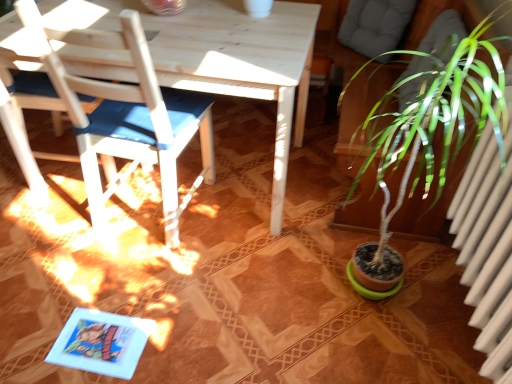
Question: Is point (82, 97) positioned closer to the camera than point (181, 91)?

Choices:
 (A) farther
 (B) closer

Answer: (B)

Question: From the image's perspective, is white wood chair at left, the first chair viewed from the left, located above or below white wood chair at left, arranged as the first chair when viewed from the right?

Choices:
 (A) below
 (B) above

Answer: (B)

Question: In terms of size, does white wood chair at left, arranged as the second chair when viewed from the right, appear bigger or smaller than white wood chair at left, which is counted as the second chair, starting from the left?

Choices:
 (A) small
 (B) big

Answer: (A)

Question: Is point (154, 134) positioned closer to the camera than point (20, 109)?

Choices:
 (A) farther
 (B) closer

Answer: (B)

Question: Is white wood chair at left, arranged as the first chair when viewed from the right, inside the boundaries of white wood chair at left, the first chair viewed from the left, or outside?

Choices:
 (A) inside
 (B) outside

Answer: (B)

Question: From the image's perspective, relative to white wood chair at left, the first chair viewed from the left, is white wood chair at left, arranged as the first chair when viewed from the right, above or below?

Choices:
 (A) below
 (B) above

Answer: (A)

Question: In terms of height, does white wood chair at left, which is counted as the second chair, starting from the left, look taller or shorter compared to white wood chair at left, arranged as the second chair when viewed from the right?

Choices:
 (A) tall
 (B) short

Answer: (A)